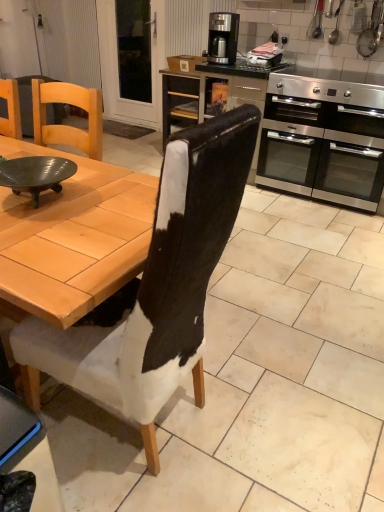
Where is `satin silver coffee maker at upper center`? satin silver coffee maker at upper center is located at coordinates (223, 37).

Describe the element at coordinates (323, 139) in the screenshot. I see `stainless steel oven at right` at that location.

The image size is (384, 512). What do you see at coordinates (211, 91) in the screenshot? I see `metallic silver oven at center right` at bounding box center [211, 91].

Where is `black leather chair at center`? The width and height of the screenshot is (384, 512). black leather chair at center is located at coordinates (157, 286).

The height and width of the screenshot is (512, 384). Describe the element at coordinates (118, 68) in the screenshot. I see `transparent glass door at upper left` at that location.

I want to click on satin silver coffee maker at upper center, so click(x=223, y=37).

Considering the relative sizes of stainless steel oven at right and transparent glass door at upper left in the image provided, is stainless steel oven at right wider than transparent glass door at upper left?

Yes, stainless steel oven at right is wider than transparent glass door at upper left.

Which of these two, stainless steel oven at right or transparent glass door at upper left, is smaller?

transparent glass door at upper left.

Could you tell me if stainless steel oven at right is facing transparent glass door at upper left?

No, stainless steel oven at right is not aimed at transparent glass door at upper left.

From a real-world perspective, between stainless steel oven at right and transparent glass door at upper left, who is vertically higher?

In real-world perspective, transparent glass door at upper left is above.

Is the position of stainless steel oven at right more distant than that of matte black bowl at left?

That is True.

Which object is wider, stainless steel oven at right or matte black bowl at left?

With larger width is stainless steel oven at right.

From a real-world perspective, is stainless steel oven at right physically located above or below matte black bowl at left?

Clearly, from a real-world perspective, stainless steel oven at right is below matte black bowl at left.

From their relative heights in the image, would you say stainless steel oven at right is taller or shorter than matte black bowl at left?

Clearly, stainless steel oven at right is taller compared to matte black bowl at left.

Is satin silver coffee maker at upper center turned away from metallic silver pot at upper right, positioned as the 1th appliance in right-to-left order?

satin silver coffee maker at upper center does not have its back to metallic silver pot at upper right, positioned as the 1th appliance in right-to-left order.

Considering the relative sizes of satin silver coffee maker at upper center and metallic silver pot at upper right, which appears as the 2th appliance when viewed from the left, in the image provided, is satin silver coffee maker at upper center smaller than metallic silver pot at upper right, which appears as the 2th appliance when viewed from the left,?

Incorrect, satin silver coffee maker at upper center is not smaller in size than metallic silver pot at upper right, which appears as the 2th appliance when viewed from the left.

Considering their positions, is satin silver coffee maker at upper center located in front of or behind metallic silver pot at upper right, which appears as the 2th appliance when viewed from the left?

Clearly, satin silver coffee maker at upper center is behind metallic silver pot at upper right, which appears as the 2th appliance when viewed from the left.

Which object is positioned more to the left, satin silver coffee maker at upper center or black leather chair at center?

black leather chair at center is more to the left.

From the image's perspective, is satin silver coffee maker at upper center positioned above or below black leather chair at center?

Based on their image positions, satin silver coffee maker at upper center is located above black leather chair at center.

Which is further, (232, 42) or (150, 319)?

The point (232, 42) is farther from the camera.

Which of these two, satin silver coffee maker at upper center or black leather chair at center, stands taller?

black leather chair at center.

In the image, is metallic silver pot at upper right, positioned as the 1th appliance in right-to-left order, on the left side or the right side of black leather chair at center?

Based on their positions, metallic silver pot at upper right, positioned as the 1th appliance in right-to-left order, is located to the right of black leather chair at center.

Which is less distant, (371,30) or (140,362)?

Point (371,30) is farther from the camera than point (140,362).

Do you think metallic silver pot at upper right, positioned as the 1th appliance in right-to-left order, is within black leather chair at center, or outside of it?

metallic silver pot at upper right, positioned as the 1th appliance in right-to-left order, is outside black leather chair at center.

In terms of size, does metallic silver pot at upper right, which appears as the 2th appliance when viewed from the left, appear bigger or smaller than black leather chair at center?

Considering their sizes, metallic silver pot at upper right, which appears as the 2th appliance when viewed from the left, takes up less space than black leather chair at center.

Is transparent glass door at upper left inside matte black bowl at left?

No, matte black bowl at left does not contain transparent glass door at upper left.

Which object is thinner, matte black bowl at left or transparent glass door at upper left?

With smaller width is transparent glass door at upper left.

Is matte black bowl at left to the left of transparent glass door at upper left from the viewer's perspective?

Incorrect, matte black bowl at left is not on the left side of transparent glass door at upper left.

Is there a large distance between matte black bowl at left and transparent glass door at upper left?

Absolutely, matte black bowl at left is distant from transparent glass door at upper left.

Considering the relative sizes of matte black bowl at left and metallic silver oven at center right in the image provided, is matte black bowl at left thinner than metallic silver oven at center right?

Yes, matte black bowl at left is thinner than metallic silver oven at center right.

From the picture: Considering the sizes of objects matte black bowl at left and metallic silver oven at center right in the image provided, who is shorter, matte black bowl at left or metallic silver oven at center right?

matte black bowl at left.

From the picture: Is matte black bowl at left far from metallic silver oven at center right?

Absolutely, matte black bowl at left is distant from metallic silver oven at center right.

You are a GUI agent. You are given a task and a screenshot of the screen. Output one action in this format:
    pyautogui.click(x=<x>, y=<y>)
    Task: Click on the screen door behind the stainless steel oven at right
    The height and width of the screenshot is (512, 384).
    Given the screenshot: What is the action you would take?
    pyautogui.click(x=118, y=68)

The image size is (384, 512). Find the location of `round table located below the stainless steel oven at right (from the image's perspective)`. round table located below the stainless steel oven at right (from the image's perspective) is located at coordinates (36, 174).

Considering their positions, is stainless steel oven at right positioned further to metallic silver pot at upper right, positioned as the 1th appliance in right-to-left order, than matte black bowl at left?

Among the two, matte black bowl at left is located further to metallic silver pot at upper right, positioned as the 1th appliance in right-to-left order.

Considering their positions, is matte black bowl at left positioned further to metallic silver oven at center right than transparent glass door at upper left?

Based on the image, matte black bowl at left appears to be further to metallic silver oven at center right.

Consider the image. Which object lies further to the anchor point black leather chair at center, metallic silver toaster at upper center, the first appliance from the left, or metallic silver oven at center right?

metallic silver toaster at upper center, the first appliance from the left, lies further to black leather chair at center than the other object.

From the image, which object appears to be farther from satin silver coffee maker at upper center, transparent glass door at upper left or matte black bowl at left?

The object further to satin silver coffee maker at upper center is matte black bowl at left.

Considering their positions, is black leather chair at center positioned closer to metallic silver oven at center right than stainless steel oven at right?

The object closer to metallic silver oven at center right is stainless steel oven at right.

Based on their spatial positions, is transparent glass door at upper left or metallic silver oven at center right closer to metallic silver pot at upper right, which appears as the 2th appliance when viewed from the left?

metallic silver oven at center right is closer to metallic silver pot at upper right, which appears as the 2th appliance when viewed from the left.

Considering their positions, is black leather chair at center positioned further to transparent glass door at upper left than metallic silver toaster at upper center, the 2th appliance in the right-to-left sequence?

Among the two, black leather chair at center is located further to transparent glass door at upper left.

Based on their spatial positions, is black leather chair at center or transparent glass door at upper left further from stainless steel oven at right?

black leather chair at center lies further to stainless steel oven at right than the other object.

Locate an element on the screen. kitchen appliance between black leather chair at center and metallic silver oven at center right along the z-axis is located at coordinates (323, 139).

The image size is (384, 512). What are the coordinates of `appliance between satin silver coffee maker at upper center and metallic silver pot at upper right, which appears as the 2th appliance when viewed from the left` in the screenshot? It's located at (264, 56).

This screenshot has width=384, height=512. Find the location of `kitchen appliance positioned between matte black bowl at left and metallic silver oven at center right from near to far`. kitchen appliance positioned between matte black bowl at left and metallic silver oven at center right from near to far is located at coordinates (323, 139).

At what (x,y) coordinates should I click in order to perform the action: click on kitchen appliance between matte black bowl at left and satin silver coffee maker at upper center in the front-back direction. Please return your answer as a coordinate pair (x, y). Looking at the image, I should click on point(323,139).